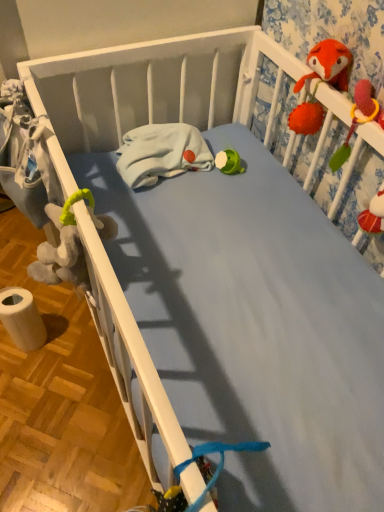
I want to click on space that is in front of white paper towel at lower left, so [30, 387].